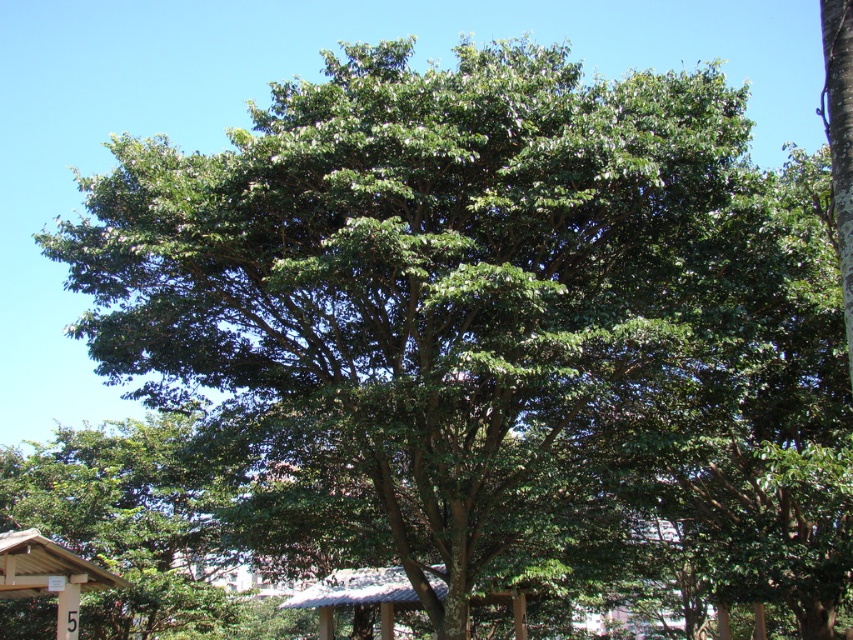
Can you confirm if thatched roof gazebo at center is shorter than wooden sign at lower left?

No.

Between thatched roof gazebo at center and wooden sign at lower left, which one is positioned higher?

wooden sign at lower left is above.

You are a GUI agent. You are given a task and a screenshot of the screen. Output one action in this format:
    pyautogui.click(x=<x>, y=<y>)
    Task: Click on the thatched roof gazebo at center
    
    Given the screenshot: What is the action you would take?
    pyautogui.click(x=357, y=595)

Find the location of a particular element. thatched roof gazebo at center is located at coordinates (357, 595).